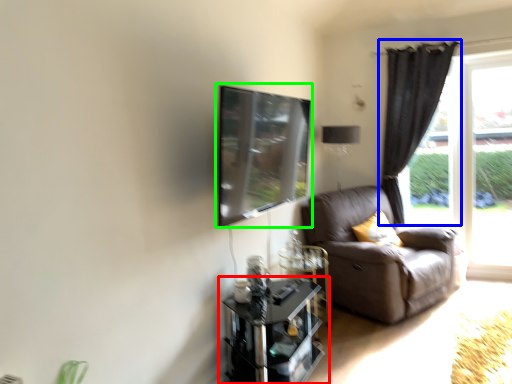
Question: Considering the real-world distances, which object is closest to table (highlighted by a red box)? curtain (highlighted by a blue box) or window screen (highlighted by a green box).

Choices:
 (A) curtain
 (B) window screen

Answer: (B)